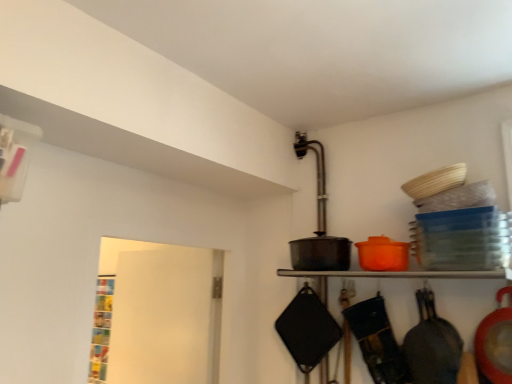
Identify the location of empty space that is ontop of white matte door at left. (161, 250).